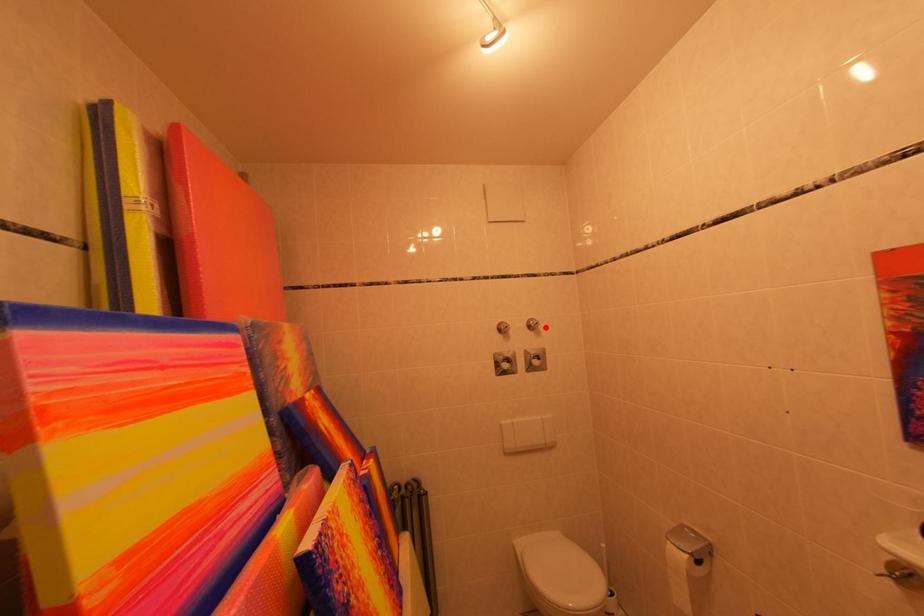
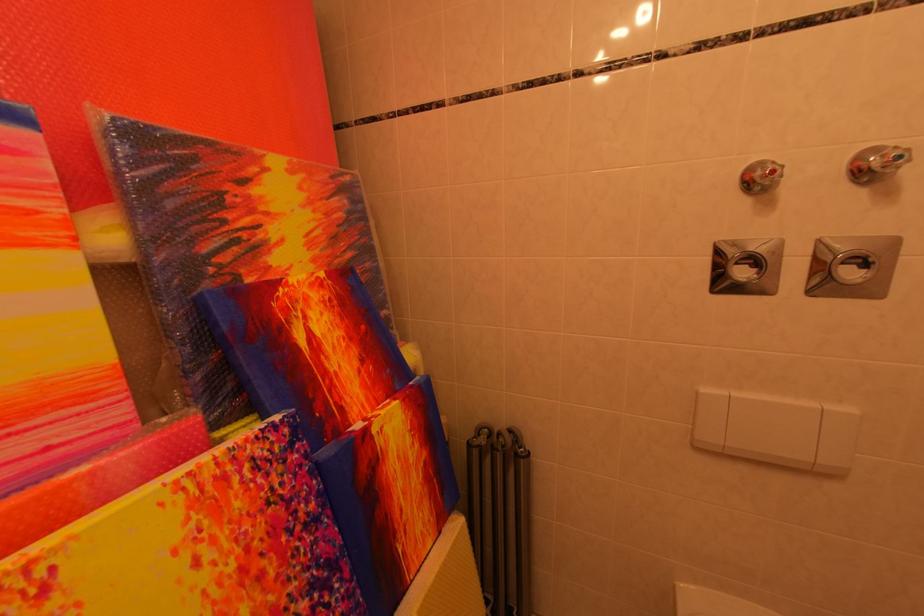
Where in the second image is the point corresponding to the highlighted location from the first image?

(907, 161)